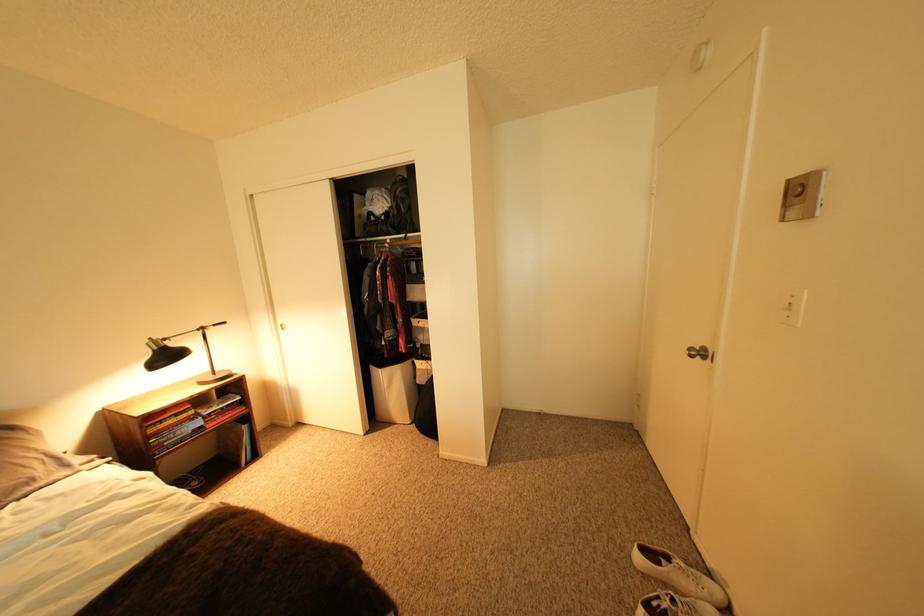
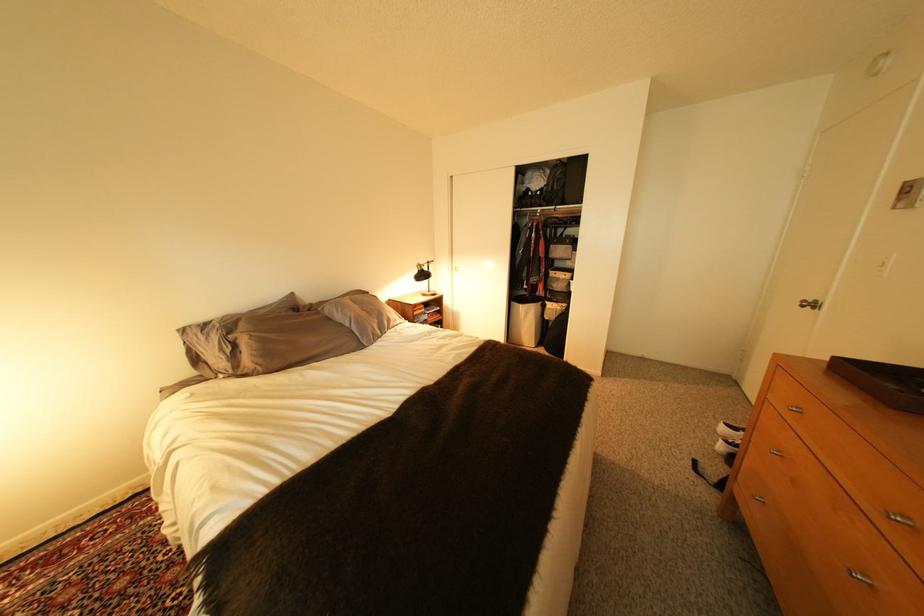
Locate, in the second image, the point that corresponds to (x=432, y=371) in the first image.

(563, 310)